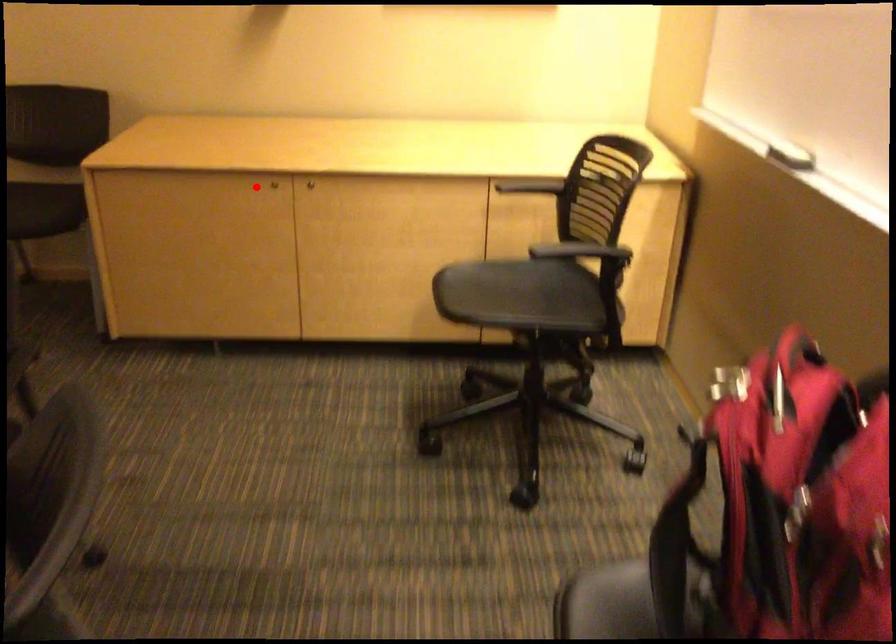
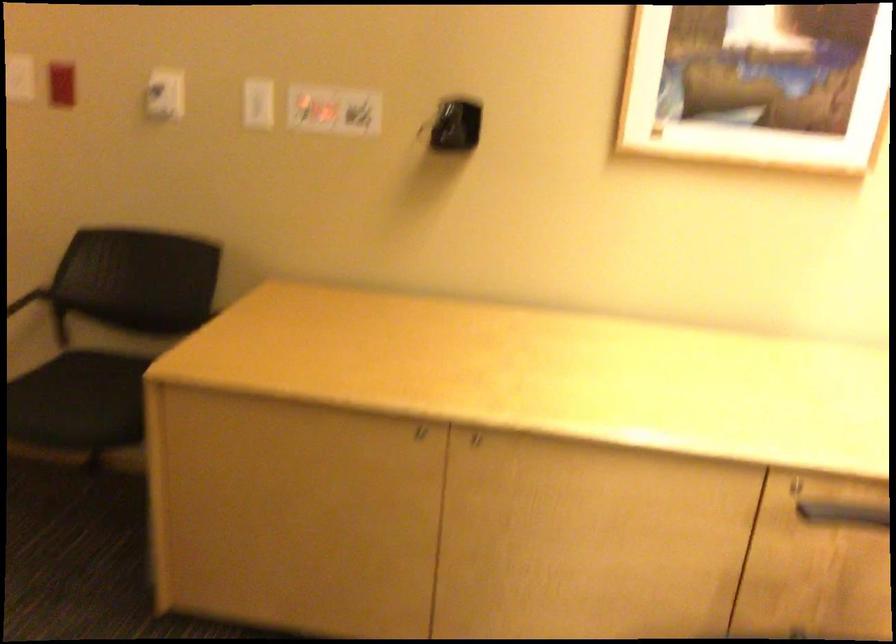
Find the pixel in the second image that matches the highlighted location in the first image.

(410, 433)